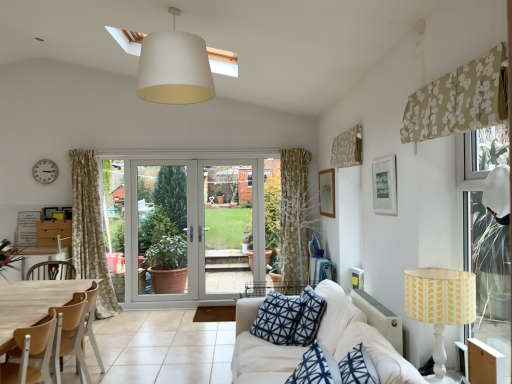
Question: In terms of size, does silver metallic clock at upper left appear bigger or smaller than white fabric lampshade at upper center?

Choices:
 (A) small
 (B) big

Answer: (A)

Question: Visually, is silver metallic clock at upper left positioned to the left or to the right of white fabric lampshade at upper center?

Choices:
 (A) left
 (B) right

Answer: (A)

Question: Which object is the farthest from the white fabric lampshade at upper center?

Choices:
 (A) white fabric couch at lower right
 (B) yellow fabric lampshade at right
 (C) silver metallic clock at upper left
 (D) wooden chair at left
 (E) white plastic screen door at center

Answer: (E)

Question: Considering the real-world distances, which object is closest to the white fabric lampshade at upper center?

Choices:
 (A) silver metallic clock at upper left
 (B) wooden chair at left
 (C) beige floral fabric at upper right, which ranks as the 1th curtain in front-to-back order
 (D) white plastic screen door at center
 (E) matte white picture frame at upper right, which is counted as the second picture frame, starting from the left

Answer: (E)